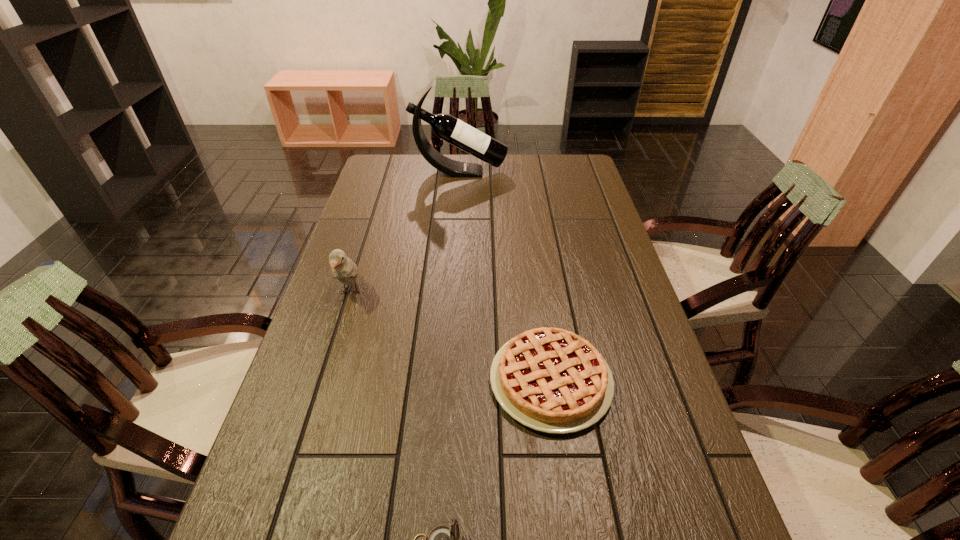
Where is `object that is the third closest one to the compass`? This screenshot has width=960, height=540. object that is the third closest one to the compass is located at coordinates [447, 127].

Where is `free spot that satisfies the following two spatial constraints: 1. on the stand of the tallest object; 2. on the back side of the shortest object`? This screenshot has width=960, height=540. free spot that satisfies the following two spatial constraints: 1. on the stand of the tallest object; 2. on the back side of the shortest object is located at coordinates (445, 381).

Where is `free space that satisfies the following two spatial constraints: 1. on the stand of the wine bottle; 2. on the back side of the pie`? This screenshot has height=540, width=960. free space that satisfies the following two spatial constraints: 1. on the stand of the wine bottle; 2. on the back side of the pie is located at coordinates click(x=445, y=381).

Where is `free space that satisfies the following two spatial constraints: 1. on the stand of the pie; 2. on the right side of the wine bottle`? This screenshot has height=540, width=960. free space that satisfies the following two spatial constraints: 1. on the stand of the pie; 2. on the right side of the wine bottle is located at coordinates (445, 381).

The height and width of the screenshot is (540, 960). What are the coordinates of `vacant region that satisfies the following two spatial constraints: 1. at the face of the pie; 2. on the left side of the second farthest object` in the screenshot? It's located at (324, 381).

Image resolution: width=960 pixels, height=540 pixels. In order to click on vacant region that satisfies the following two spatial constraints: 1. on the stand of the farthest object; 2. on the back side of the third farthest object in this screenshot , I will do `click(445, 381)`.

Where is `vacant space that satisfies the following two spatial constraints: 1. at the face of the third nearest object; 2. on the left side of the second nearest object`? vacant space that satisfies the following two spatial constraints: 1. at the face of the third nearest object; 2. on the left side of the second nearest object is located at coordinates (324, 381).